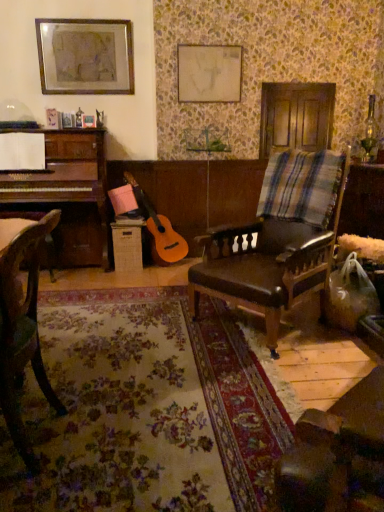
Find the location of a particular element. vacant space in front of brown leather chair at center, which is the first chair in back-to-front order is located at coordinates (271, 372).